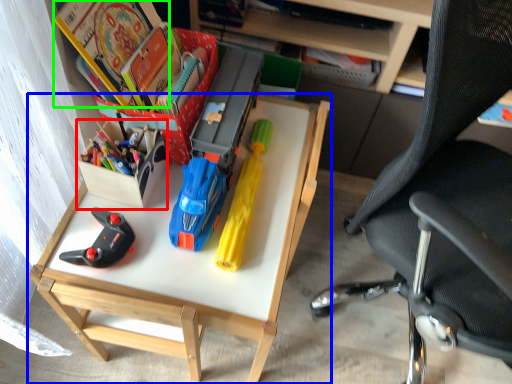
Question: Estimate the real-world distances between objects in this image. Which object is closer to kit (highlighted by a red box), desk (highlighted by a blue box) or book (highlighted by a green box)?

Choices:
 (A) desk
 (B) book

Answer: (B)